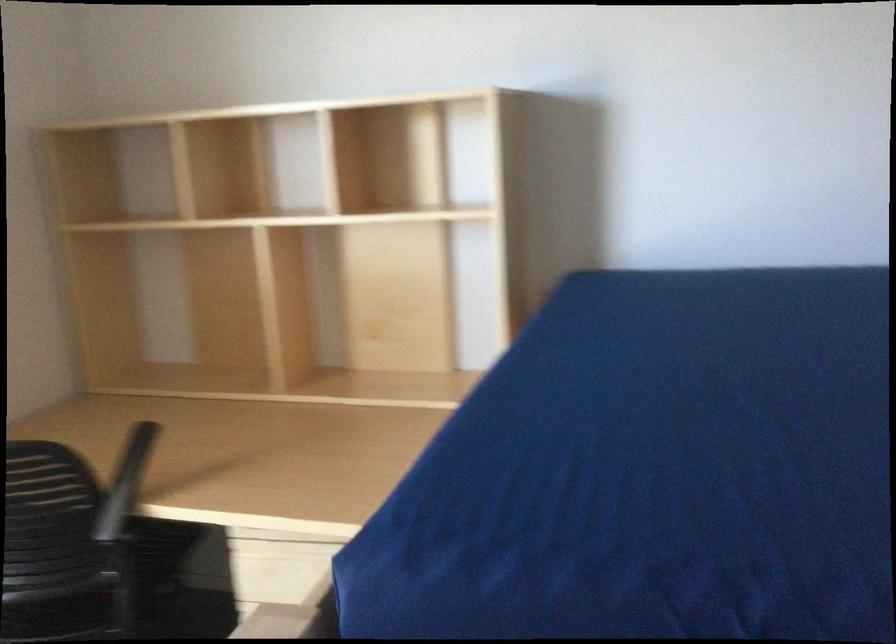
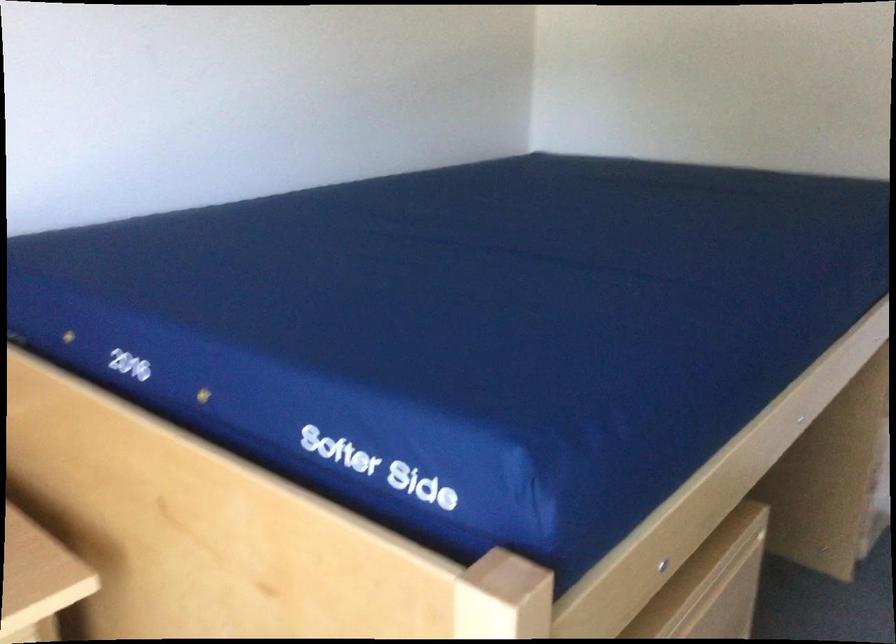
Locate, in the second image, the point that corresponds to (731,412) in the first image.

(469, 299)